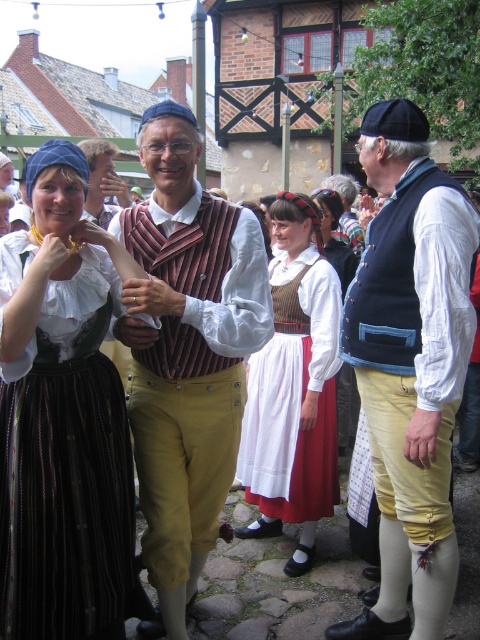
You are a photographer positioned at the back of the crowd, aiming to capture both the matte black dirndl at left and the matte brown vest at center in your shot. Which of these two items will appear larger in your photo?

The matte black dirndl at left will appear larger in the photo because it is closer to the viewer than the matte brown vest at center.

You are at a festival with cobblestone ground and rustic buildings. You see a point marked at coordinates (62, 417). What object is located at that point?

The point at coordinates (62, 417) indicates the location of the matte black dirndl at left.